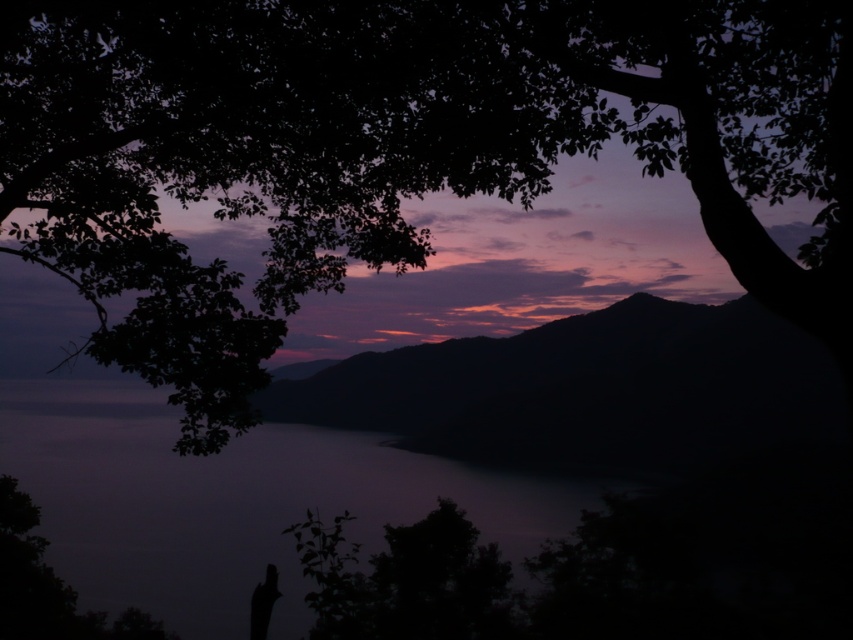
You are standing in the twilight scene and want to walk towards the smooth water at center and the silhouette figure at lower left. Which object will you encounter first?

You will encounter the smooth water at center first because it is closer to you than the silhouette figure at lower left, which is further away.

Consider the image. You are standing at the edge of the scene and want to walk towards the silhouette figure at lower left. Is the smooth water at center blocking your path?

The smooth water at center has a greater height compared to the silhouette figure at lower left, so the water is taller than the figure. Therefore, the smooth water at center might block your path to the silhouette figure at lower left depending on the terrain.